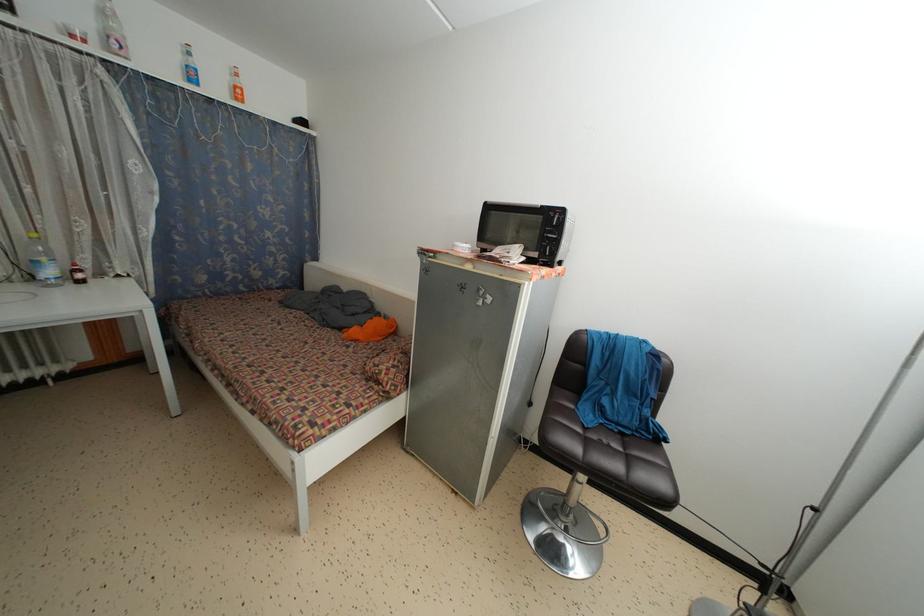
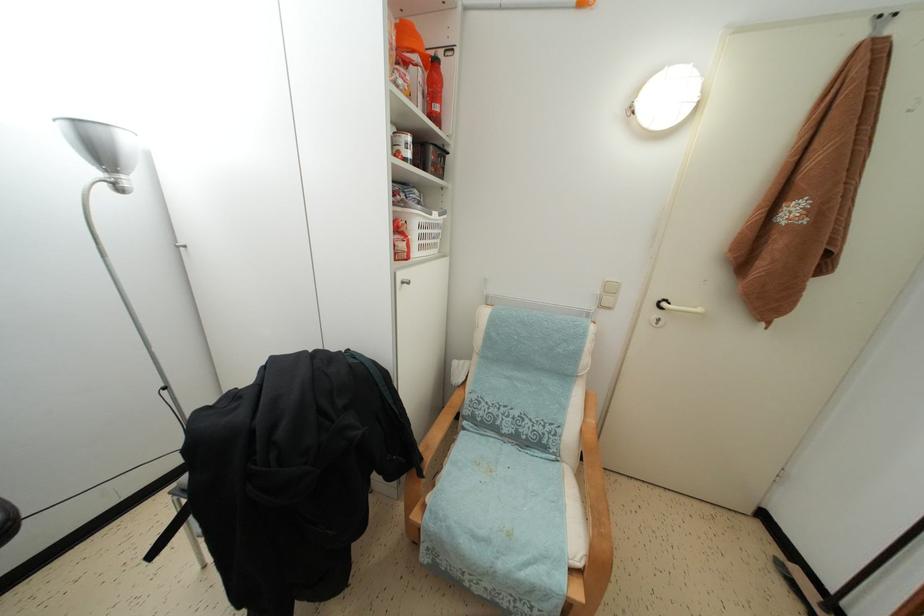
The first image is from the beginning of the video and the second image is from the end. How did the camera likely rotate when shooting the video?

The camera rotated toward right-down.